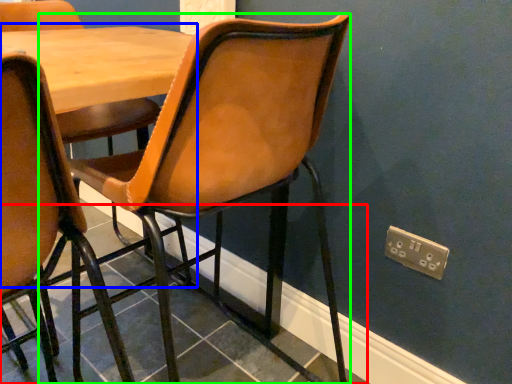
Question: Which object is positioned farthest from tile (highlighted by a red box)? Select from table (highlighted by a blue box) and chair (highlighted by a green box).

Choices:
 (A) table
 (B) chair

Answer: (A)